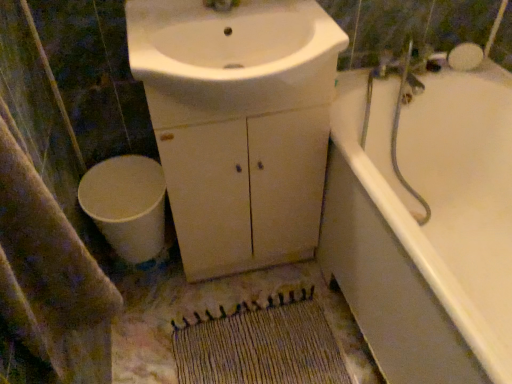
Question: From the image's perspective, is white matte toilet at lower left over beige textured bath towel at lower left?

Choices:
 (A) no
 (B) yes

Answer: (A)

Question: Is white matte toilet at lower left at the left side of beige textured bath towel at lower left?

Choices:
 (A) no
 (B) yes

Answer: (B)

Question: Is white matte toilet at lower left oriented away from beige textured bath towel at lower left?

Choices:
 (A) no
 (B) yes

Answer: (A)

Question: Is white matte toilet at lower left facing towards beige textured bath towel at lower left?

Choices:
 (A) yes
 (B) no

Answer: (B)

Question: From a real-world perspective, is white matte toilet at lower left on top of beige textured bath towel at lower left?

Choices:
 (A) yes
 (B) no

Answer: (B)

Question: Looking at the image, does woven beige mat at lower center seem bigger or smaller compared to white matte toilet at lower left?

Choices:
 (A) big
 (B) small

Answer: (B)

Question: Would you say woven beige mat at lower center is inside or outside white matte toilet at lower left?

Choices:
 (A) inside
 (B) outside

Answer: (B)

Question: From the image's perspective, is woven beige mat at lower center located above or below white matte toilet at lower left?

Choices:
 (A) below
 (B) above

Answer: (A)

Question: Considering the positions of point (303, 379) and point (155, 251), is point (303, 379) closer or farther from the camera than point (155, 251)?

Choices:
 (A) closer
 (B) farther

Answer: (A)

Question: Do you think white glossy sink at center is within white matte cabinet at center, or outside of it?

Choices:
 (A) inside
 (B) outside

Answer: (A)

Question: Considering the positions of white glossy sink at center and white matte cabinet at center in the image, is white glossy sink at center bigger or smaller than white matte cabinet at center?

Choices:
 (A) small
 (B) big

Answer: (A)

Question: Would you say white glossy sink at center is to the left or to the right of white matte cabinet at center in the picture?

Choices:
 (A) left
 (B) right

Answer: (A)

Question: In the image, is white glossy sink at center positioned in front of or behind white matte cabinet at center?

Choices:
 (A) front
 (B) behind

Answer: (A)

Question: Looking at the image, does white matte toilet at lower left seem bigger or smaller compared to white glossy sink at center?

Choices:
 (A) small
 (B) big

Answer: (A)

Question: Is white matte toilet at lower left to the left or to the right of white glossy sink at center in the image?

Choices:
 (A) left
 (B) right

Answer: (A)